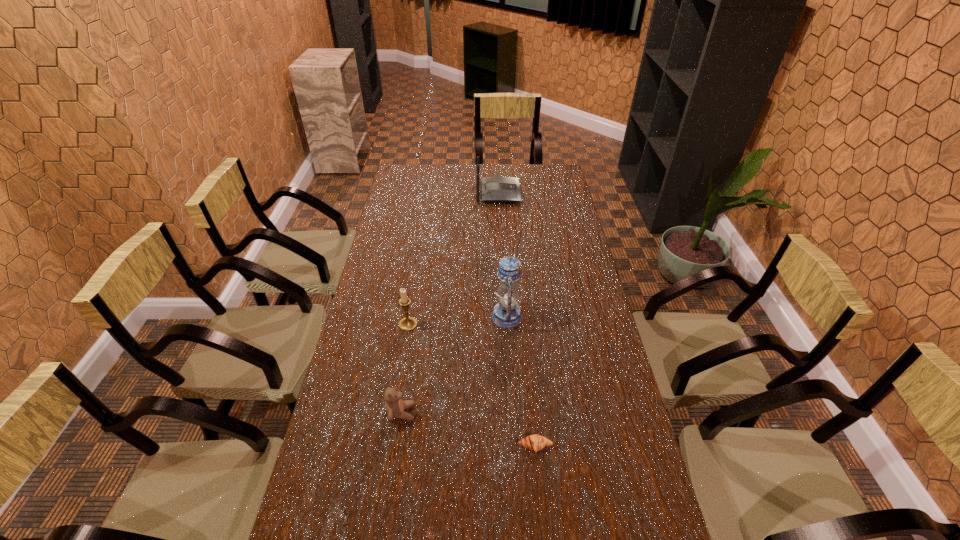
This screenshot has height=540, width=960. I want to click on free space between the tallest object and the router, so click(502, 255).

The image size is (960, 540). Identify the location of free space between the router and the teddy bear. (449, 303).

Find the location of a particular element. blank region between the shortest object and the teddy bear is located at coordinates click(468, 429).

Image resolution: width=960 pixels, height=540 pixels. I want to click on vacant point located between the candle holder and the nearest object, so click(x=471, y=385).

Identify the location of free spot between the shortest object and the fourth tallest object. (468, 429).

Locate an element on the screen. vacant region between the teddy bear and the farthest object is located at coordinates (449, 303).

Select which object appears as the third closest to the fourth farthest object. Please provide its 2D coordinates. Your answer should be formatted as a tuple, i.e. [(x, y)], where the tuple contains the x and y coordinates of a point satisfying the conditions above.

[(506, 314)]

Where is `object that is the fourth closest to the tallest object`? The height and width of the screenshot is (540, 960). object that is the fourth closest to the tallest object is located at coordinates (494, 189).